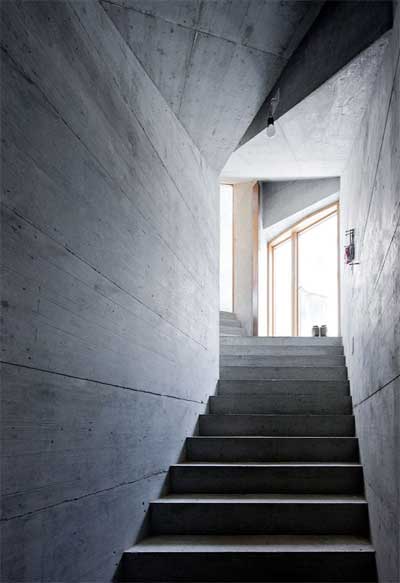
You are a GUI agent. You are given a task and a screenshot of the screen. Output one action in this format:
    pyautogui.click(x=<x>, y=<y>)
    Task: Click on the space above patio doors
    This screenshot has width=400, height=583.
    Given the screenshot: What is the action you would take?
    pyautogui.click(x=285, y=194)